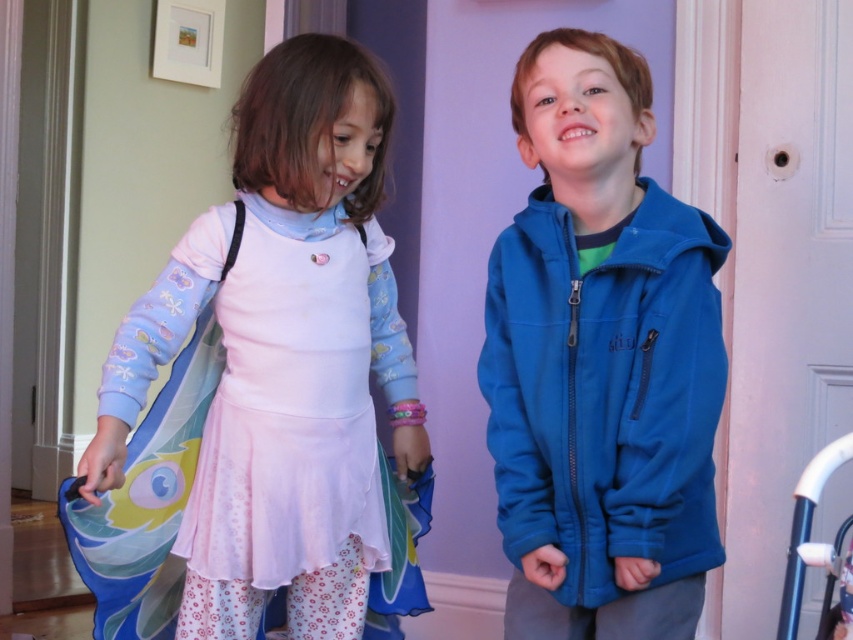
You are a photographer setting up for a family photo. You need to position a prop at the exact center of the image. The pastel pink fabric dress at center is currently at point 0.567, 0.328. Is the dress already at the image center?

The pastel pink fabric dress at center is located at point (279, 362), which means it is not exactly at the image center since the exact center would be at coordinates (426, 320).

You are a photographer setting up a photo shoot for two children wearing the pastel pink fabric dress at center and the blue fleece jacket at center. You want to ensure that the dress is visible in the frame without being blocked by the jacket. Based on their heights, which child should stand behind the other?

The pastel pink fabric dress at center is taller than the blue fleece jacket at center, so the child wearing the blue fleece jacket at center should stand behind the child in the pastel pink fabric dress at center to ensure visibility.